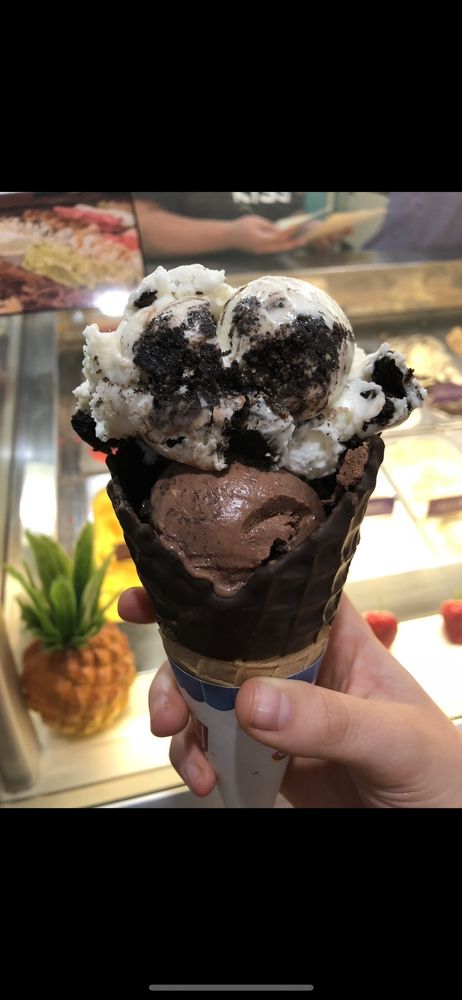
Identify the location of bakery display. This screenshot has width=462, height=1000. (414, 502).